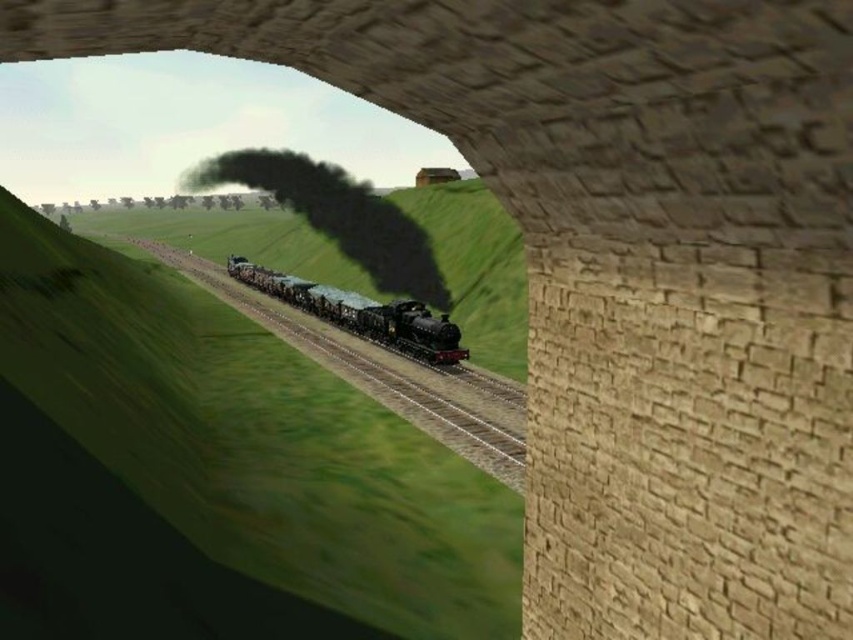
You are a maintenance worker needing to inspect the shiny black track at center and the polished black locomotive at center. Given that your inspection tool has a maximum reach of 2 meters, can you safely inspect both objects without moving closer?

The shiny black track at center and polished black locomotive at center are 1.94 meters apart from each other. Since your tool can reach up to 2 meters, you can safely inspect both objects without moving closer.

You are standing inside the stone archway and want to take a photo of the shiny black track at center and the black matte steam at center. Which object should you focus on first if you want to capture both in the same frame without moving the camera?

The shiny black track at center is positioned on the right side of black matte steam at center, so you should focus on the black matte steam at center first to ensure both objects are in the frame without moving the camera.

You are standing inside the stone archway and want to take a photo of the shiny black track at center. Where should you aim your camera to capture it?

You should aim your camera at point (x=387, y=374) to capture the shiny black track at center.